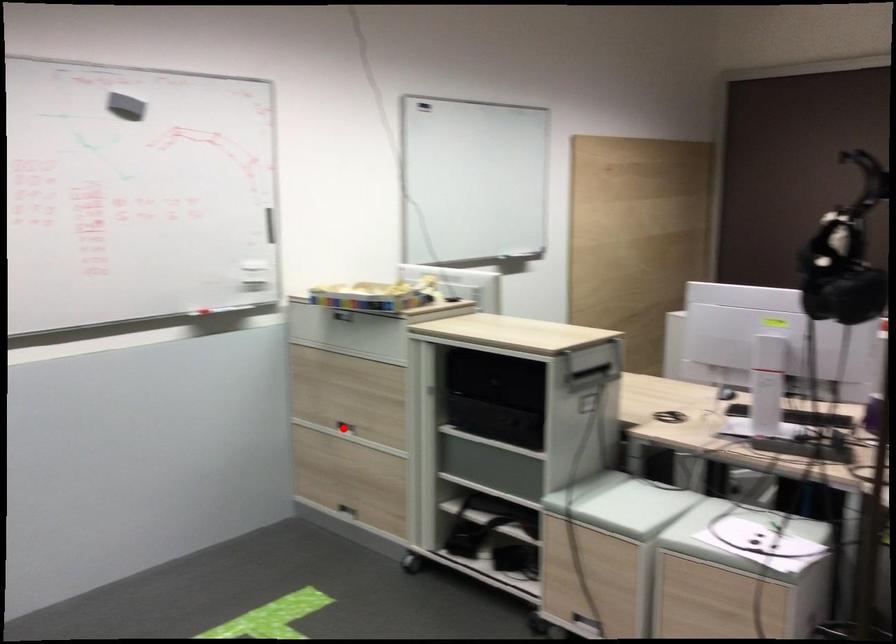
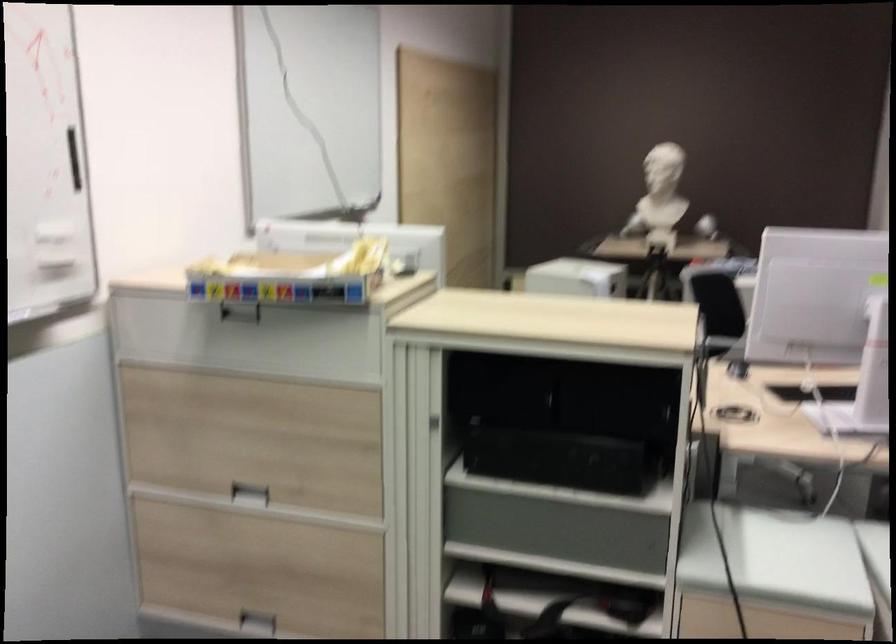
Where in the second image is the point corresponding to the highlighted location from the first image?

(250, 494)